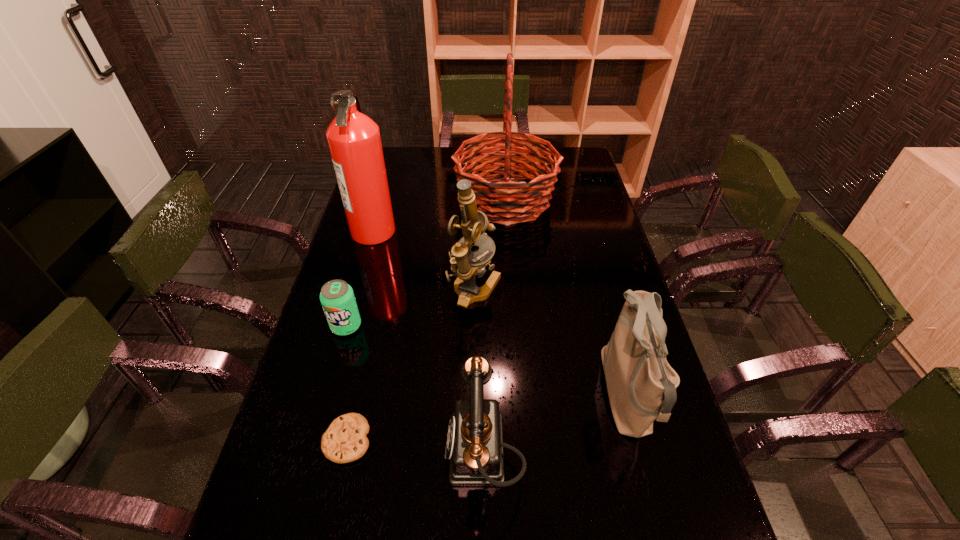
Locate an element on the screen. The image size is (960, 540). vacant space located on the back of the basket is located at coordinates (503, 163).

The height and width of the screenshot is (540, 960). Find the location of `vacant space situated 0.170m at the nozzle of the fire extinguisher`. vacant space situated 0.170m at the nozzle of the fire extinguisher is located at coordinates (444, 231).

I want to click on vacant space located on the back of the third tallest object, so click(474, 246).

Where is `blank space located 0.140m on the front-facing side of the fourth tallest object`? blank space located 0.140m on the front-facing side of the fourth tallest object is located at coordinates (544, 395).

You are a GUI agent. You are given a task and a screenshot of the screen. Output one action in this format:
    pyautogui.click(x=<x>, y=<y>)
    Task: Click on the free region located 0.140m on the front-facing side of the fourth tallest object
    The width and height of the screenshot is (960, 540).
    Given the screenshot: What is the action you would take?
    pyautogui.click(x=544, y=395)

Where is `free location located 0.240m on the front-facing side of the fourth tallest object`? The image size is (960, 540). free location located 0.240m on the front-facing side of the fourth tallest object is located at coordinates (504, 395).

Find the location of `vacant space located 0.130m on the front of the third shortest object at the rotary dial`. vacant space located 0.130m on the front of the third shortest object at the rotary dial is located at coordinates (387, 453).

Where is `vacant space located on the front of the third shortest object at the rotary dial`? vacant space located on the front of the third shortest object at the rotary dial is located at coordinates (293, 453).

In order to click on free space located on the front of the third shortest object at the rotary dial in this screenshot , I will do `click(289, 453)`.

In order to click on blank space located on the front-facing side of the sixth tallest object in this screenshot , I will do `click(307, 465)`.